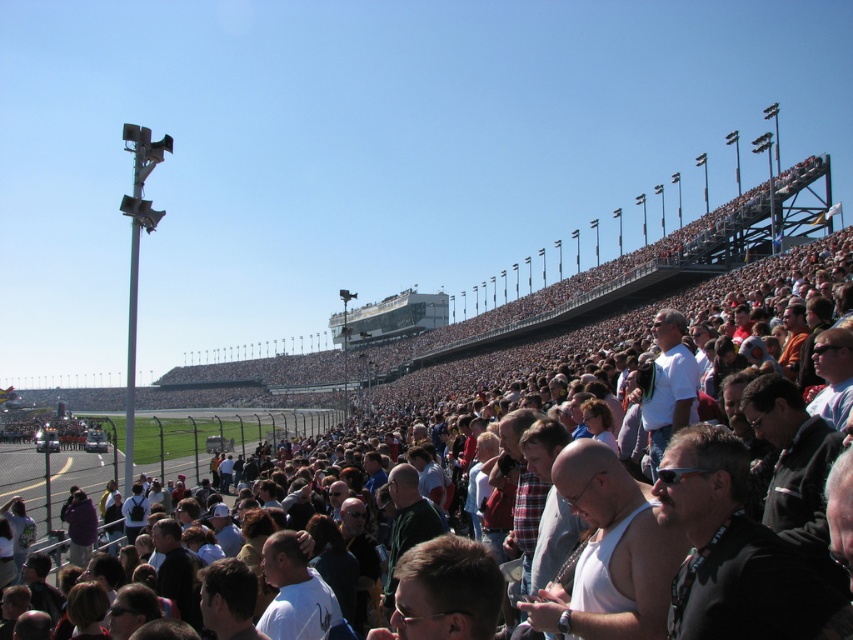
You are a photographer standing at the edge of the racetrack and you want to take a photo of the white tank top at center and the purple fabric jacket at lower left. Which of the two clothing items has a greater width?

The white tank top at center has a greater width than the purple fabric jacket at lower left.